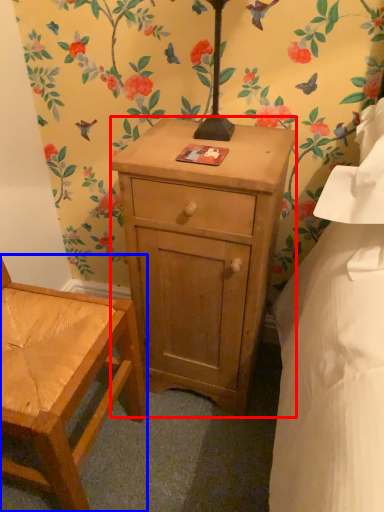
Question: Among these objects, which one is farthest to the camera, nightstand (highlighted by a red box) or chair (highlighted by a blue box)?

Choices:
 (A) nightstand
 (B) chair

Answer: (A)